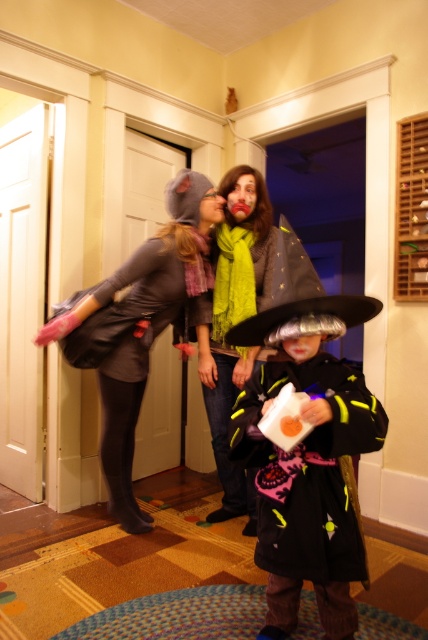
Who is lower down, matte gray dress at left or shiny silver witch hat at center?

shiny silver witch hat at center

Is matte gray dress at left behind shiny silver witch hat at center?

No, it is in front of shiny silver witch hat at center.

Which is in front, point (107, 385) or point (226, 240)?

Point (107, 385) is more forward.

The image size is (428, 640). In order to click on matte gray dress at left in this screenshot , I will do `click(137, 324)`.

Does matte black costume at center have a larger size compared to matte gray dress at left?

Incorrect, matte black costume at center is not larger than matte gray dress at left.

You are a GUI agent. You are given a task and a screenshot of the screen. Output one action in this format:
    pyautogui.click(x=<x>, y=<y>)
    Task: Click on the matte black costume at center
    
    Given the screenshot: What is the action you would take?
    pyautogui.click(x=309, y=460)

Is matte black costume at center bigger than shiny silver witch hat at center?

Incorrect, matte black costume at center is not larger than shiny silver witch hat at center.

Does point (234, 433) come in front of point (219, 243)?

Yes, point (234, 433) is closer to viewer.

Locate an element on the screen. This screenshot has width=428, height=640. matte black costume at center is located at coordinates (309, 460).